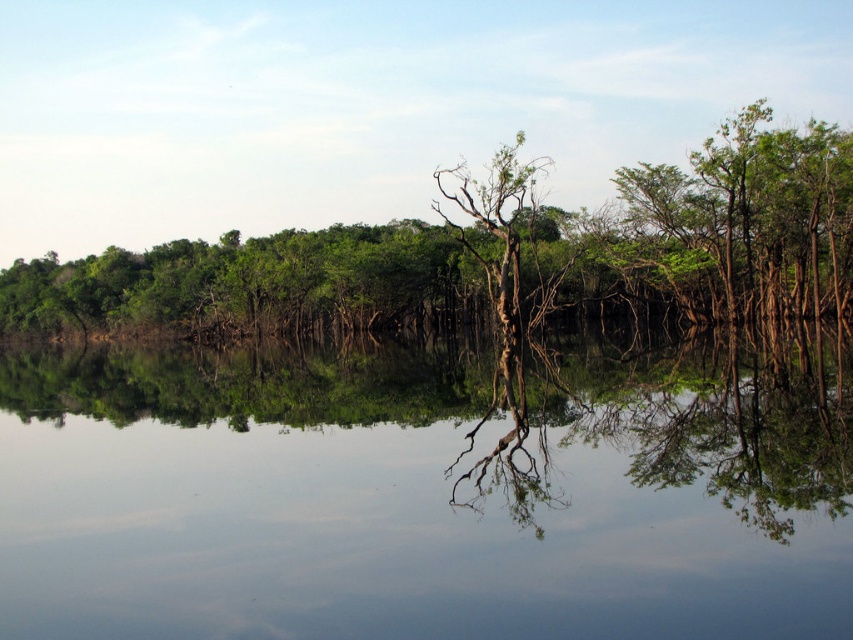
Which of these two, transparent water at center or green matte tree at center, stands shorter?

transparent water at center is shorter.

Is point (206, 440) more distant than point (248, 280)?

That is False.

The height and width of the screenshot is (640, 853). I want to click on transparent water at center, so click(404, 500).